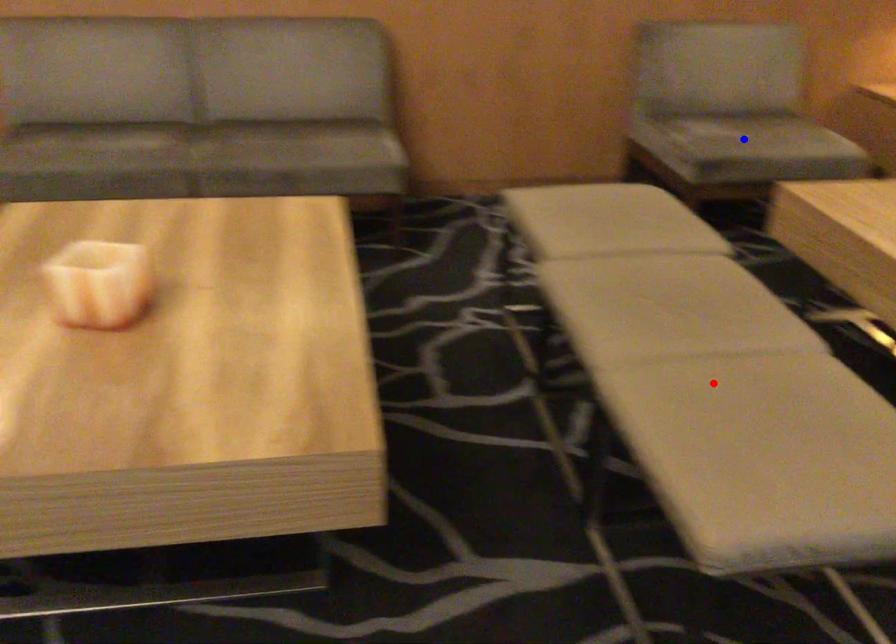
Question: Which of the two points in the image is closer to the camera?

Choices:
 (A) Blue point is closer.
 (B) Red point is closer.

Answer: (B)